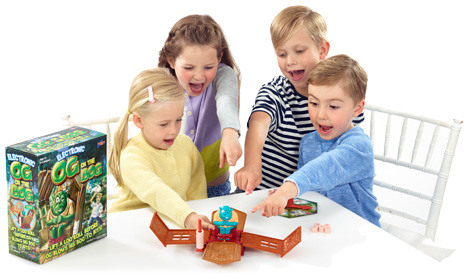
Identify the location of table. Image resolution: width=472 pixels, height=279 pixels. (125, 243).